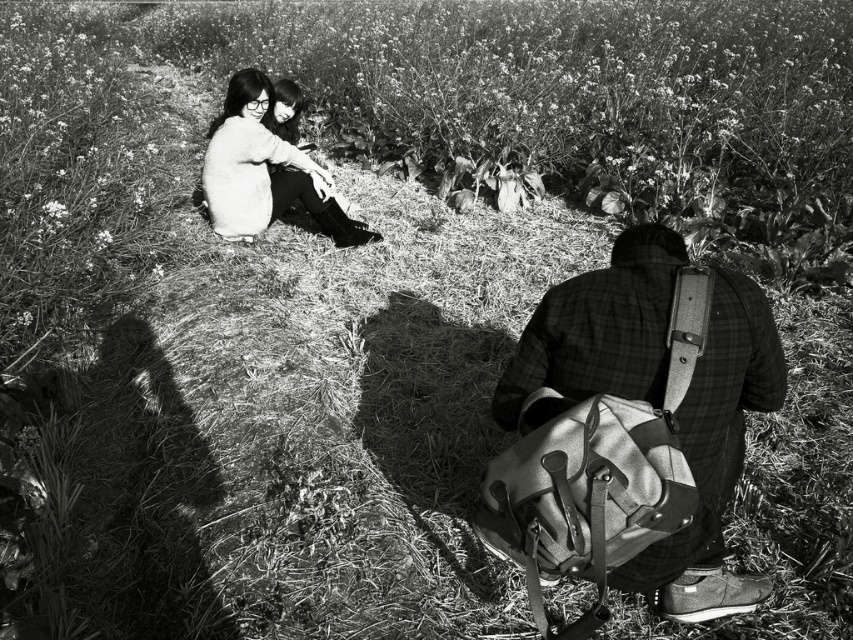
Question: Does plaid fabric shirt at lower right lie behind soft white sweater at upper left?

Choices:
 (A) no
 (B) yes

Answer: (A)

Question: Which of the following is the farthest from the observer?

Choices:
 (A) plaid fabric shirt at lower right
 (B) soft white sweater at upper left

Answer: (B)

Question: Does plaid fabric shirt at lower right have a larger size compared to soft white sweater at upper left?

Choices:
 (A) no
 (B) yes

Answer: (A)

Question: Which point appears closest to the camera in this image?

Choices:
 (A) (236, 140)
 (B) (637, 291)

Answer: (B)

Question: Is plaid fabric shirt at lower right thinner than soft white sweater at upper left?

Choices:
 (A) yes
 (B) no

Answer: (A)